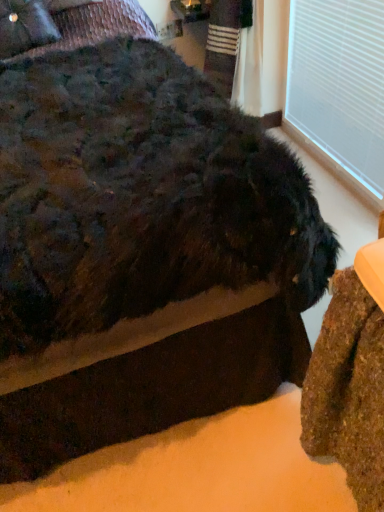
Question: Can you confirm if white plastic window frame at upper right is taller than fuzzy black dog at center?

Choices:
 (A) yes
 (B) no

Answer: (B)

Question: From the image's perspective, does white plastic window frame at upper right appear higher than fuzzy black dog at center?

Choices:
 (A) no
 (B) yes

Answer: (B)

Question: Is white plastic window frame at upper right looking in the opposite direction of fuzzy black dog at center?

Choices:
 (A) no
 (B) yes

Answer: (A)

Question: From a real-world perspective, is white plastic window frame at upper right located higher than fuzzy black dog at center?

Choices:
 (A) yes
 (B) no

Answer: (B)

Question: Can we say white plastic window frame at upper right lies outside fuzzy black dog at center?

Choices:
 (A) no
 (B) yes

Answer: (B)

Question: Does white plastic window frame at upper right touch fuzzy black dog at center?

Choices:
 (A) yes
 (B) no

Answer: (B)

Question: From a real-world perspective, does velvet-like dark brown pillow at upper left sit lower than fuzzy black dog at center?

Choices:
 (A) yes
 (B) no

Answer: (B)

Question: Does velvet-like dark brown pillow at upper left have a greater width compared to fuzzy black dog at center?

Choices:
 (A) no
 (B) yes

Answer: (A)

Question: Can you confirm if velvet-like dark brown pillow at upper left is thinner than fuzzy black dog at center?

Choices:
 (A) no
 (B) yes

Answer: (B)

Question: From a real-world perspective, is velvet-like dark brown pillow at upper left over fuzzy black dog at center?

Choices:
 (A) no
 (B) yes

Answer: (B)

Question: Does velvet-like dark brown pillow at upper left have a smaller size compared to fuzzy black dog at center?

Choices:
 (A) no
 (B) yes

Answer: (B)

Question: From the image's perspective, is velvet-like dark brown pillow at upper left on top of fuzzy black dog at center?

Choices:
 (A) yes
 (B) no

Answer: (A)

Question: Considering the relative sizes of fuzzy black dog at center and white plastic window frame at upper right in the image provided, is fuzzy black dog at center smaller than white plastic window frame at upper right?

Choices:
 (A) yes
 (B) no

Answer: (B)